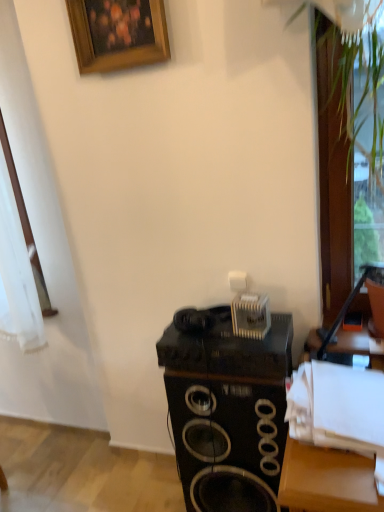
Question: Based on their sizes in the image, would you say black matte speaker at center is bigger or smaller than transparent glass door at right?

Choices:
 (A) big
 (B) small

Answer: (A)

Question: Does point (266, 381) appear closer or farther from the camera than point (329, 65)?

Choices:
 (A) closer
 (B) farther

Answer: (A)

Question: Considering the real-world distances, which object is farthest from the black matte speaker at center?

Choices:
 (A) wooden picture frame at upper center
 (B) transparent glass door at right

Answer: (A)

Question: Estimate the real-world distances between objects in this image. Which object is farther from the transparent glass door at right?

Choices:
 (A) wooden picture frame at upper center
 (B) black matte speaker at center

Answer: (B)